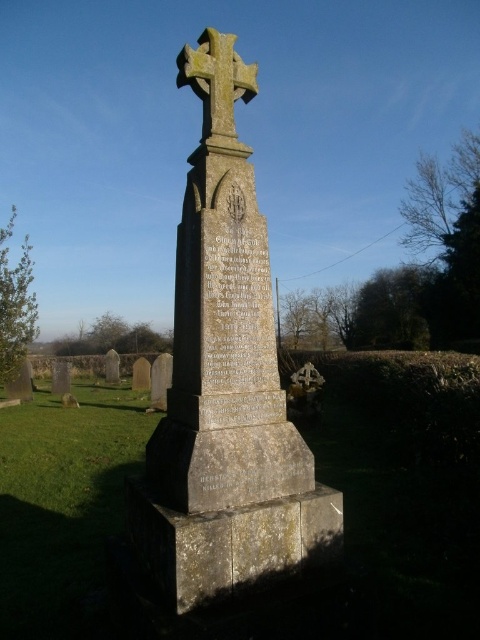
Question: Which of the following is the farthest from the observer?

Choices:
 (A) (231, 35)
 (B) (158, 582)

Answer: (A)

Question: Is stone cross at center in front of yellow stone cross at center?

Choices:
 (A) no
 (B) yes

Answer: (B)

Question: Which point is closer to the camera?

Choices:
 (A) yellow stone cross at center
 (B) stone cross at center

Answer: (B)

Question: Does stone cross at center lie behind yellow stone cross at center?

Choices:
 (A) no
 (B) yes

Answer: (A)

Question: Is stone cross at center wider than yellow stone cross at center?

Choices:
 (A) no
 (B) yes

Answer: (B)